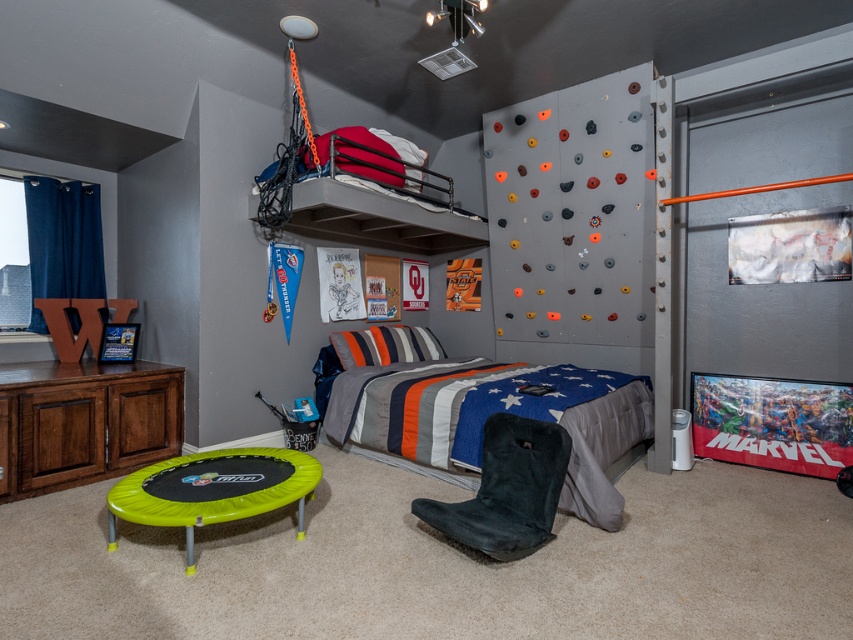
You are standing at the entrance of the bedroom and want to find the striped fabric bed at center. According to the coordinates provided, in which direction should you look to locate it?

The striped fabric bed at center is located at coordinates point (489, 413), which means it is positioned to the right and slightly above the center of the room.

You are a parent setting up a child safety gate in the bedroom. The gate needs to be placed between the brown wood dresser at lower left and the matte black bunk bed at upper center. Based on their positions, where should the gate be installed?

The brown wood dresser at lower left is below the matte black bunk bed at upper center, so the gate should be installed between them horizontally to separate the lower and upper areas of the bedroom.